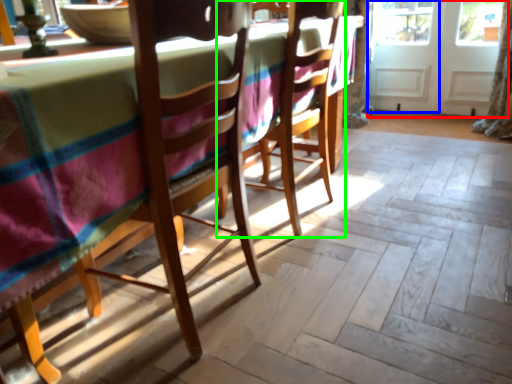
Question: Which object is the farthest from screen door (highlighted by a red box)? Choose among these: screen door (highlighted by a blue box) or chair (highlighted by a green box).

Choices:
 (A) screen door
 (B) chair

Answer: (B)